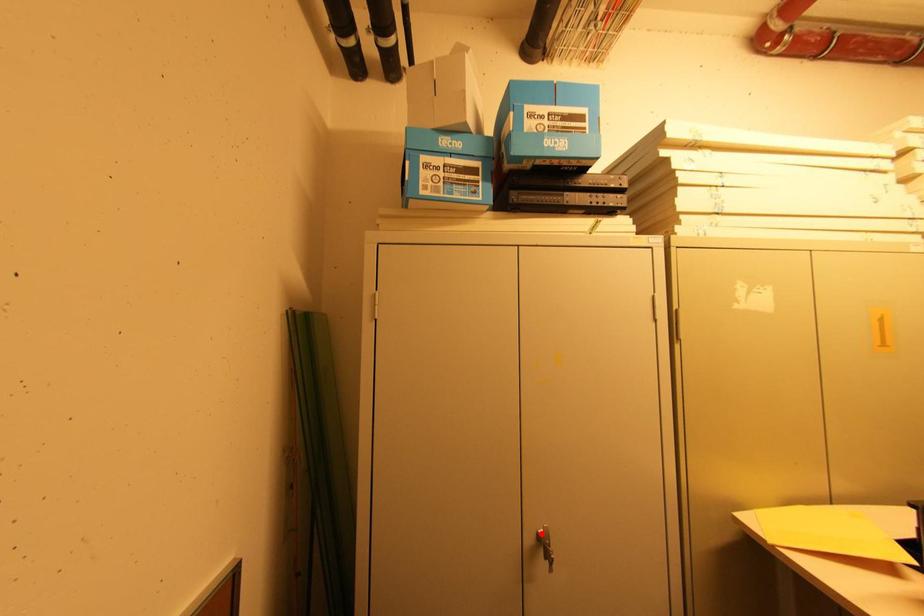
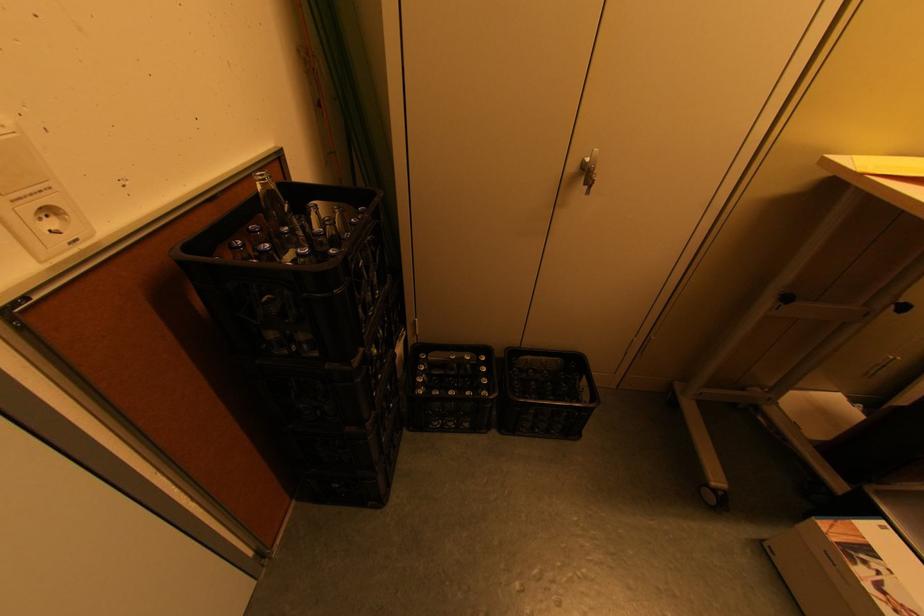
In the second image, find the point that corresponds to the highlighted location in the first image.

(587, 161)